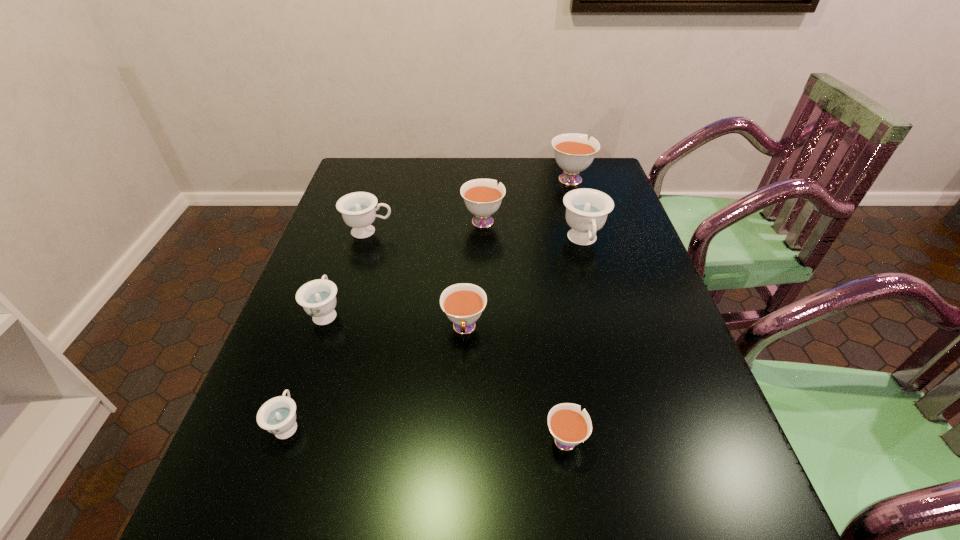
In the image, there is a desktop. Where is `vacant space at the right edge`? vacant space at the right edge is located at coordinates (671, 394).

Locate an element on the screen. vacant space at the far left corner of the desktop is located at coordinates (372, 164).

Identify the location of vacant space at the far right corner of the desktop. (584, 183).

What are the coordinates of `free space between the second biggest blue teacup and the third farthest blue teacup` in the screenshot? It's located at (348, 272).

At what (x,y) coordinates should I click in order to perform the action: click on vacant space in between the biggest blue teacup and the third smallest blue teacup. Please return your answer as a coordinate pair (x, y). This screenshot has height=540, width=960. Looking at the image, I should click on (476, 237).

I want to click on vacant point located between the rightmost blue teacup and the third smallest white teacup, so click(533, 231).

Find the location of a particular element. The height and width of the screenshot is (540, 960). vacant region between the third smallest blue teacup and the second nearest white teacup is located at coordinates (417, 280).

The width and height of the screenshot is (960, 540). Identify the location of free space that is in between the biggest blue teacup and the second biggest blue teacup. (476, 237).

Where is `vacant space that's between the second nearest blue teacup and the third smallest blue teacup`? vacant space that's between the second nearest blue teacup and the third smallest blue teacup is located at coordinates (348, 272).

Where is `free space between the nearest blue teacup and the second nearest blue teacup`? This screenshot has height=540, width=960. free space between the nearest blue teacup and the second nearest blue teacup is located at coordinates (307, 368).